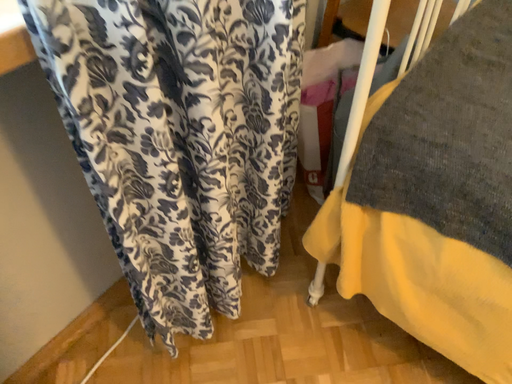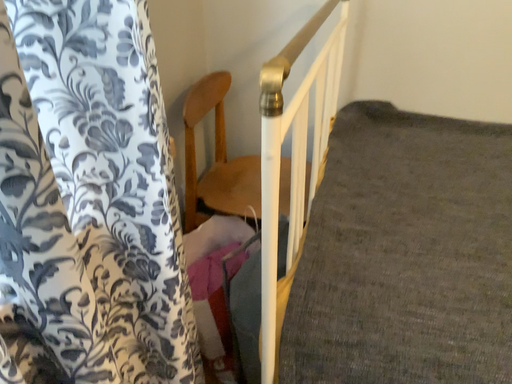
Question: How did the camera likely rotate when shooting the video?

Choices:
 (A) rotated right
 (B) rotated left

Answer: (A)